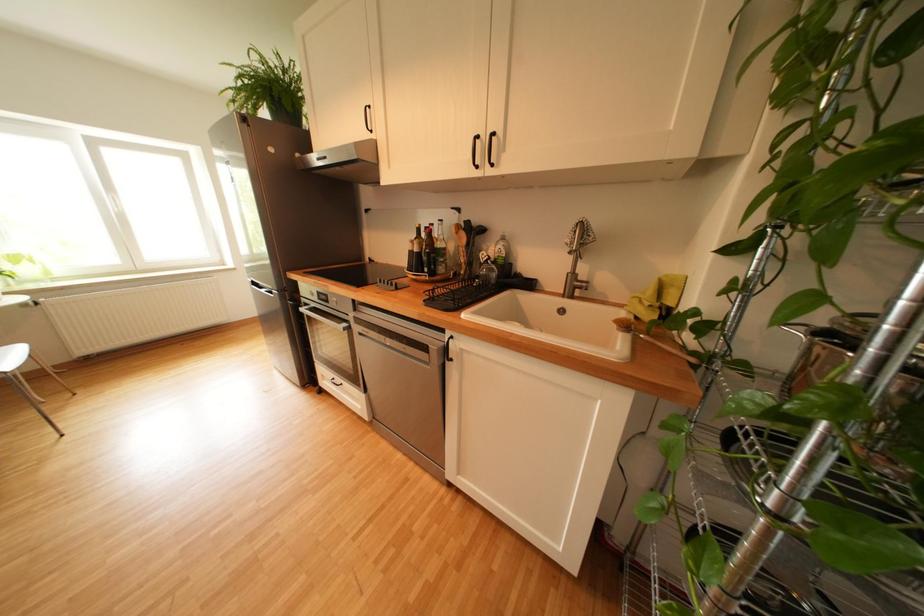
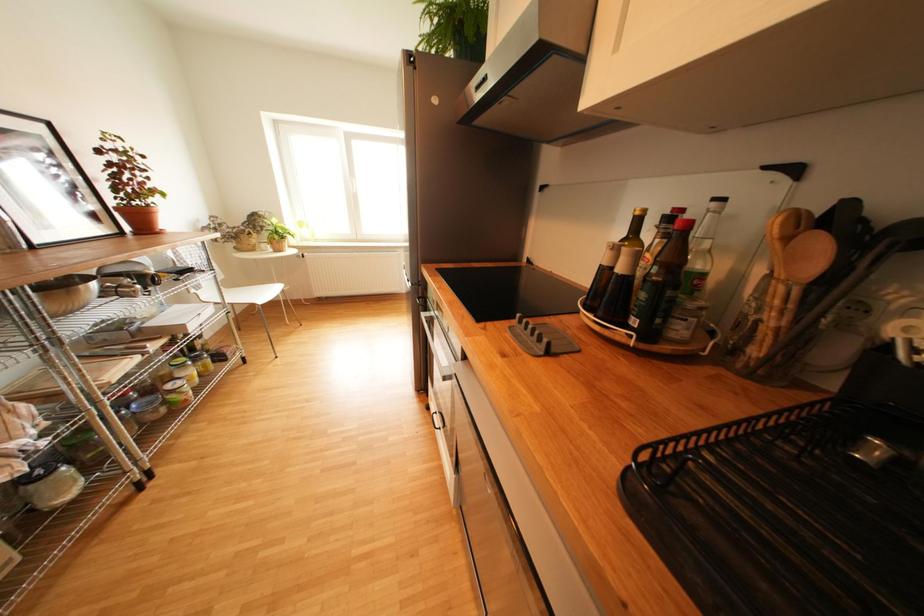
Question: How did the camera likely rotate?

Choices:
 (A) Left
 (B) Right
 (C) Up
 (D) Down

Answer: (A)